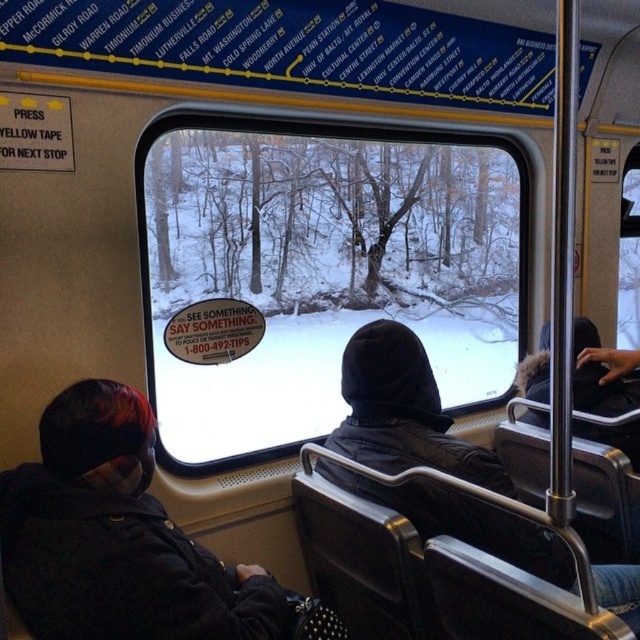
Question: Which of the following is the farthest from the observer?

Choices:
 (A) (502, 552)
 (B) (440, 248)
 (C) (42, 470)

Answer: (B)

Question: Does dark gray jacket at lower left appear on the left side of black leather jacket at center?

Choices:
 (A) yes
 (B) no

Answer: (A)

Question: Which of the following is the closest to the observer?

Choices:
 (A) (369, 417)
 (B) (161, 380)

Answer: (A)

Question: Which of the following is the closest to the observer?

Choices:
 (A) (257, 291)
 (B) (417, 417)

Answer: (B)

Question: In this image, where is dark gray jacket at lower left located relative to black leather jacket at center?

Choices:
 (A) above
 (B) below

Answer: (B)

Question: Where is transparent glass window at center located in relation to black leather jacket at center in the image?

Choices:
 (A) below
 (B) above

Answer: (B)